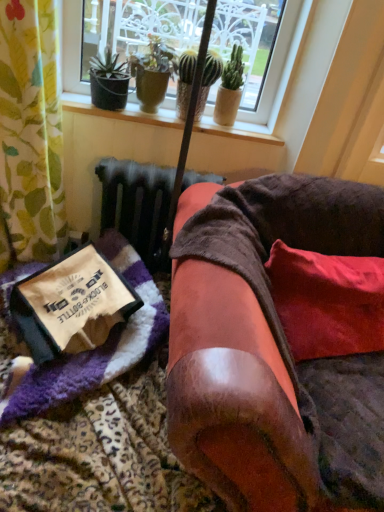
Question: Which direction should I rotate to face green textured cactus at upper center, which is the second houseplant in right-to-left order, — up or down?

Choices:
 (A) up
 (B) down

Answer: (A)

Question: Does purple fuzzy blanket at lower left appear on the right side of green textured cactus at upper center, which is the second houseplant in right-to-left order?

Choices:
 (A) yes
 (B) no

Answer: (B)

Question: From a real-world perspective, is purple fuzzy blanket at lower left located higher than green textured cactus at upper center, the second houseplant in the left-to-right sequence?

Choices:
 (A) yes
 (B) no

Answer: (B)

Question: Does purple fuzzy blanket at lower left have a smaller size compared to green textured cactus at upper center, which is the second houseplant in right-to-left order?

Choices:
 (A) yes
 (B) no

Answer: (B)

Question: Is purple fuzzy blanket at lower left oriented away from green textured cactus at upper center, the second houseplant in the left-to-right sequence?

Choices:
 (A) yes
 (B) no

Answer: (B)

Question: Is the depth of purple fuzzy blanket at lower left less than that of green textured cactus at upper center, the second houseplant in the left-to-right sequence?

Choices:
 (A) yes
 (B) no

Answer: (A)

Question: Is purple fuzzy blanket at lower left taller than green textured cactus at upper center, the second houseplant in the left-to-right sequence?

Choices:
 (A) yes
 (B) no

Answer: (B)

Question: Is green matte cactus at upper center, which is the third houseplant from left to right, shorter than green textured cactus at upper center, which is the second houseplant in right-to-left order?

Choices:
 (A) no
 (B) yes

Answer: (A)

Question: From a real-world perspective, does green matte cactus at upper center, which is the 1th houseplant from right to left, sit lower than green textured cactus at upper center, the second houseplant in the left-to-right sequence?

Choices:
 (A) yes
 (B) no

Answer: (B)

Question: Could green textured cactus at upper center, the second houseplant in the left-to-right sequence, be considered to be inside green matte cactus at upper center, which is the 1th houseplant from right to left?

Choices:
 (A) yes
 (B) no

Answer: (B)

Question: From a real-world perspective, is green matte cactus at upper center, which is the 1th houseplant from right to left, physically above green textured cactus at upper center, the second houseplant in the left-to-right sequence?

Choices:
 (A) yes
 (B) no

Answer: (A)

Question: Is green matte cactus at upper center, which is the third houseplant from left to right, at the right side of green textured cactus at upper center, the second houseplant in the left-to-right sequence?

Choices:
 (A) yes
 (B) no

Answer: (A)

Question: Considering the relative sizes of green matte cactus at upper center, which is the third houseplant from left to right, and green textured cactus at upper center, which is the second houseplant in right-to-left order, in the image provided, is green matte cactus at upper center, which is the third houseplant from left to right, bigger than green textured cactus at upper center, which is the second houseplant in right-to-left order,?

Choices:
 (A) yes
 (B) no

Answer: (B)

Question: Is green textured cactus at upper center, the second houseplant in the left-to-right sequence, not close to red velvet pillow at lower right?

Choices:
 (A) yes
 (B) no

Answer: (B)